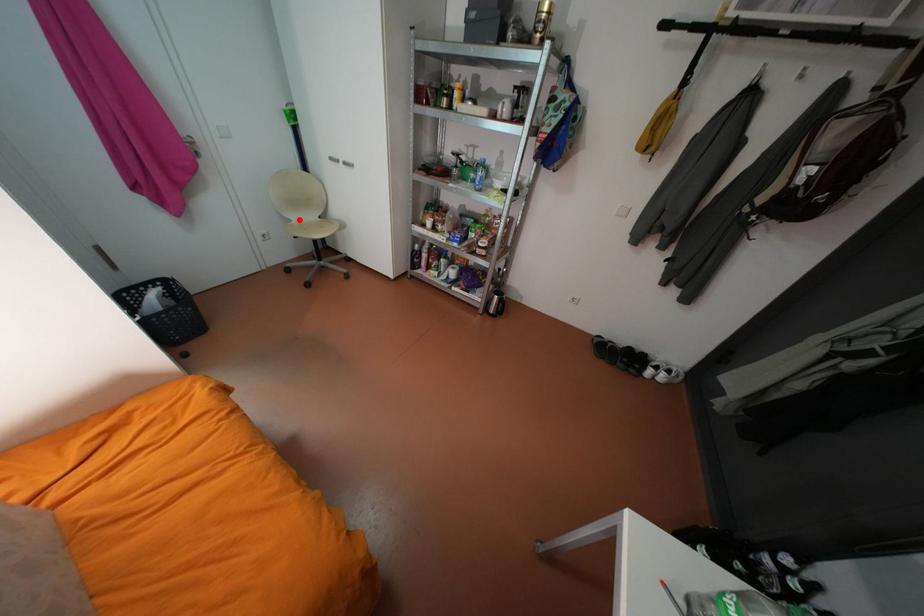
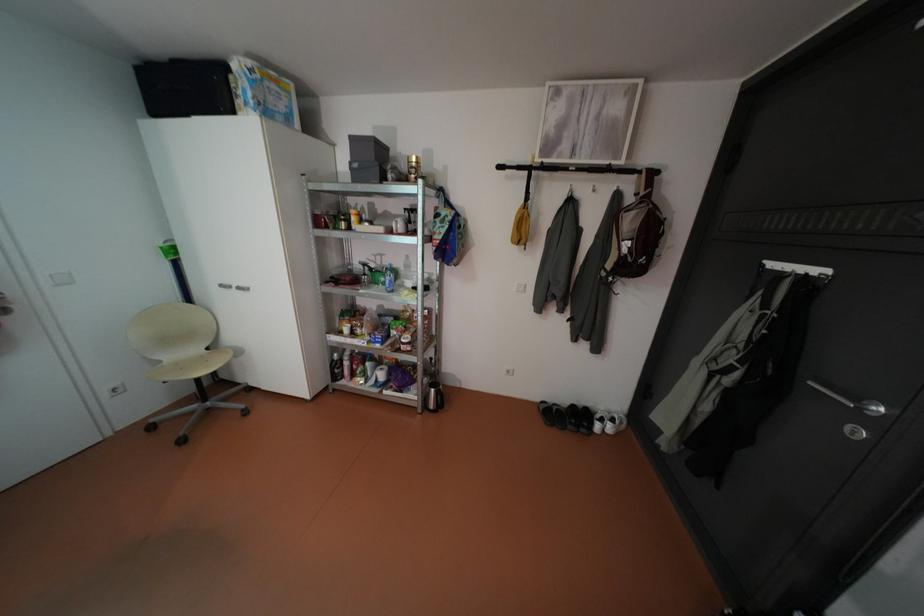
Question: I am providing you with two images of the same scene from different viewpoints. Image1 has a red point marked. In image2, the corresponding 3D location appears at what relative position? Reply with the corresponding letter.

Choices:
 (A) Closer
 (B) Farther

Answer: (B)